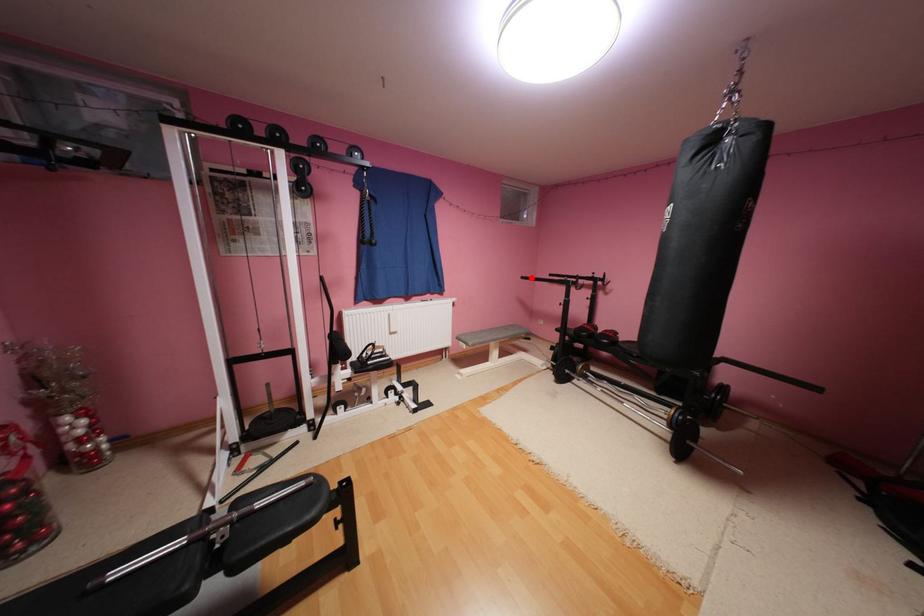
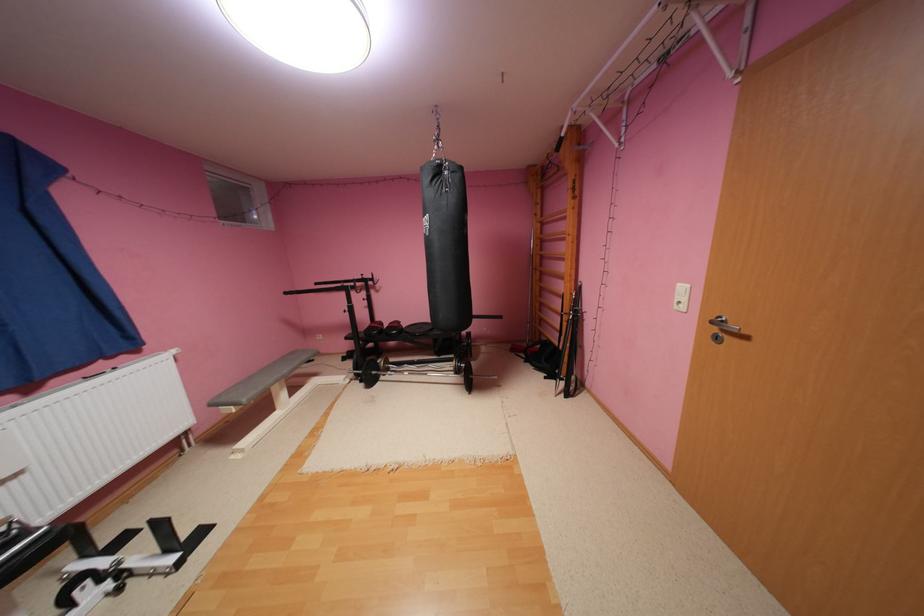
The point at the highlighted location is marked in the first image. Where is the corresponding point in the second image?

(295, 293)